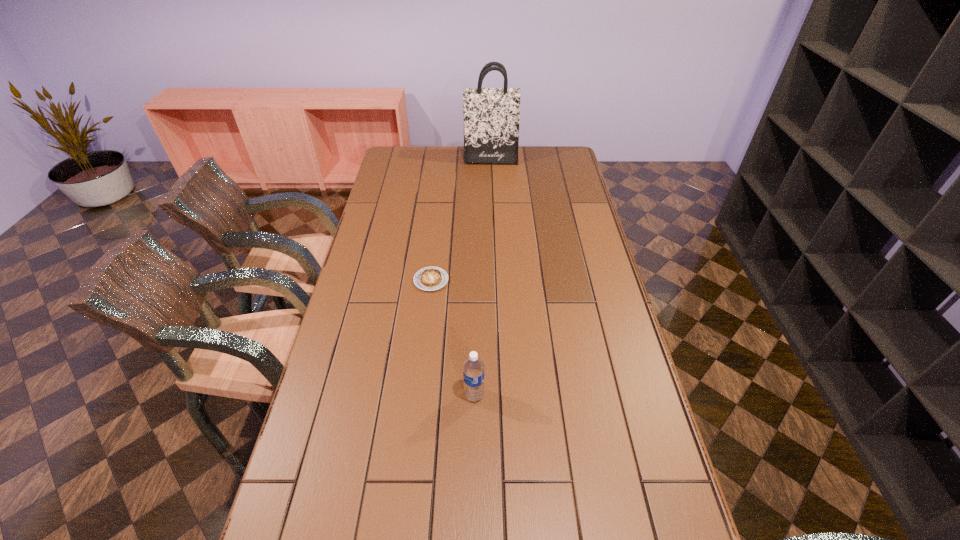
What are the coordinates of `empty location between the tallest object and the second shortest object` in the screenshot? It's located at (482, 278).

Where is `free space between the second tallest object and the leftmost object`? The image size is (960, 540). free space between the second tallest object and the leftmost object is located at coordinates (453, 338).

Identify the location of free area in between the shopping bag and the second shortest object. This screenshot has width=960, height=540. (x=482, y=278).

Point out which object is positioned as the nearest to the tallest object. Please provide its 2D coordinates. Your answer should be formatted as a tuple, i.e. [(x, y)], where the tuple contains the x and y coordinates of a point satisfying the conditions above.

[(429, 278)]

Where is `the second closest object to the nearest object`? The image size is (960, 540). the second closest object to the nearest object is located at coordinates (491, 115).

The width and height of the screenshot is (960, 540). What are the coordinates of `vacant space that satisfies the following two spatial constraints: 1. on the front side of the leftmost object; 2. on the right side of the nearest object` in the screenshot? It's located at (418, 395).